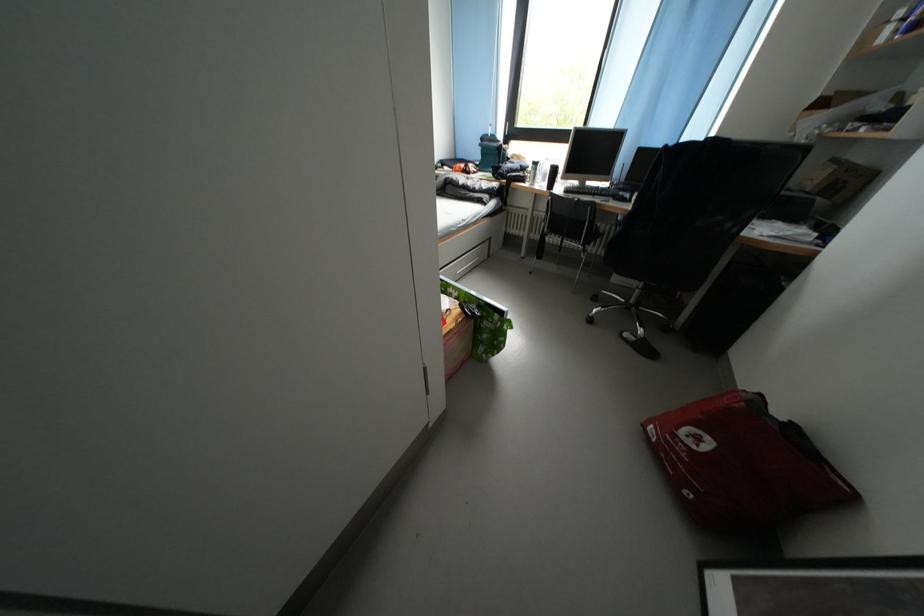
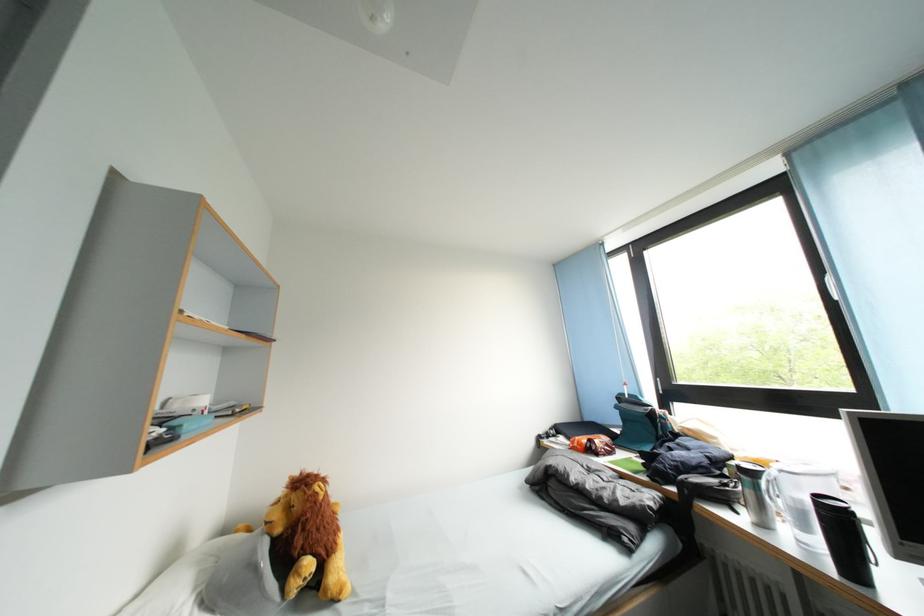
The point at (x=544, y=169) is marked in the first image. Where is the corresponding point in the second image?

(759, 479)